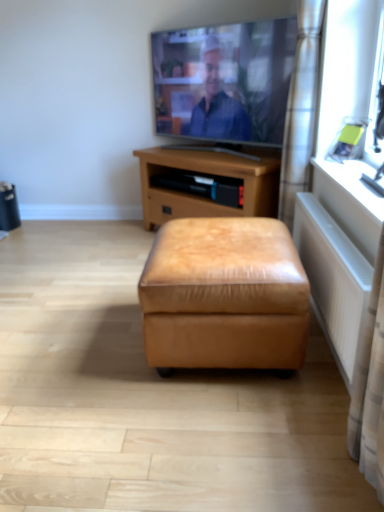
Find the location of a particular element. The image size is (384, 512). free space to the left of tan leather ottoman at center is located at coordinates (86, 360).